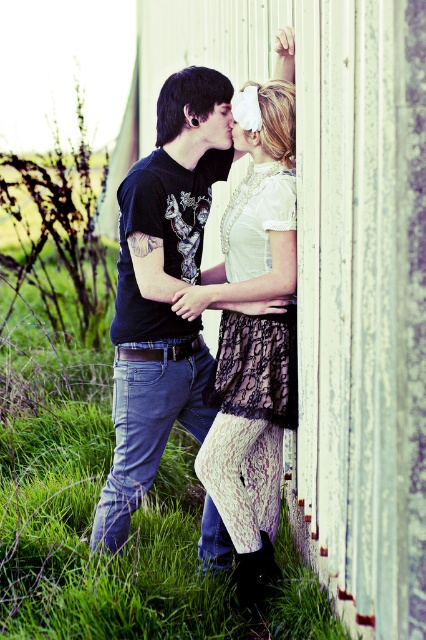
Is matte black t-shirt at center below white lace dress at center?

No, matte black t-shirt at center is not below white lace dress at center.

Who is positioned more to the left, matte black t-shirt at center or white lace dress at center?

matte black t-shirt at center is more to the left.

The height and width of the screenshot is (640, 426). I want to click on matte black t-shirt at center, so click(x=161, y=291).

Is white painted wood at upper center smaller than white lace dress at center?

Yes, white painted wood at upper center is smaller than white lace dress at center.

Who is lower down, white painted wood at upper center or white lace dress at center?

white lace dress at center is below.

Locate an element on the screen. This screenshot has width=426, height=640. white painted wood at upper center is located at coordinates (340, 273).

Between white painted wood at upper center and matte black t-shirt at center, which one has more height?

With more height is matte black t-shirt at center.

Who is more distant from viewer, (209, 342) or (138, 406)?

Point (209, 342)

At what (x,y) coordinates should I click in order to perform the action: click on white painted wood at upper center. Please return your answer as a coordinate pair (x, y). The width and height of the screenshot is (426, 640). Looking at the image, I should click on (340, 273).